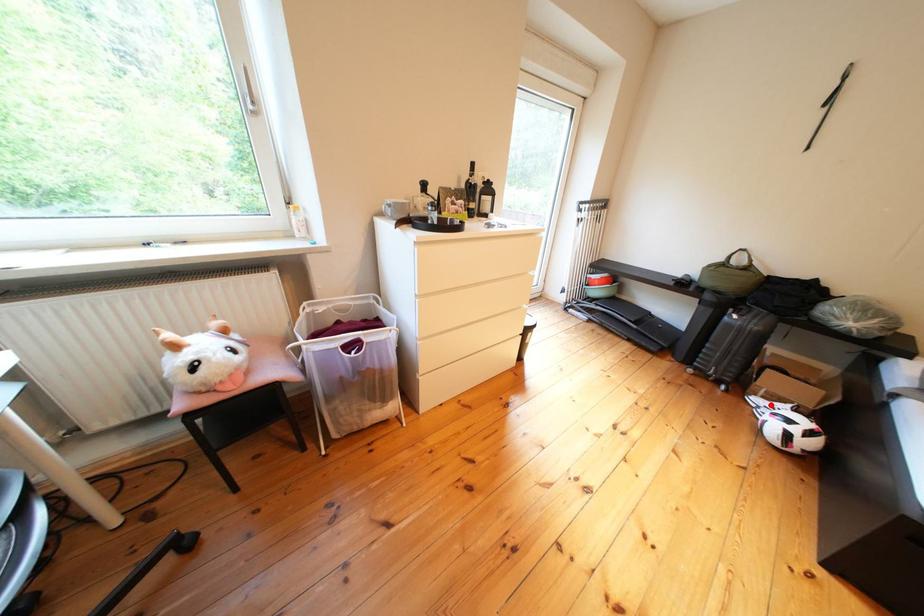
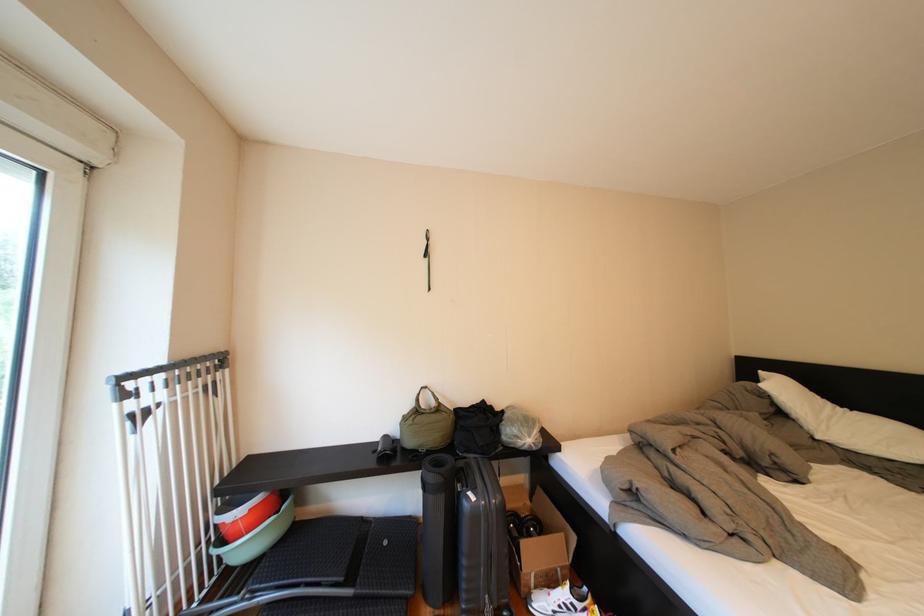
Question: I am providing you with two images of the same scene from different viewpoints. Given a red point in image1, look at the same physical point in image2. Is it:

Choices:
 (A) Closer to the viewpoint
 (B) Farther from the viewpoint

Answer: (A)